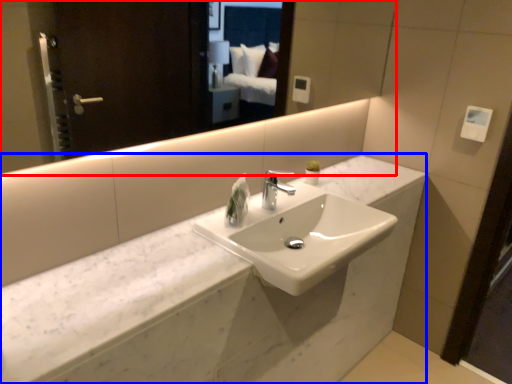
Question: Which of the following is the closest to the observer, mirror (highlighted by a red box) or counter (highlighted by a blue box)?

Choices:
 (A) mirror
 (B) counter

Answer: (A)